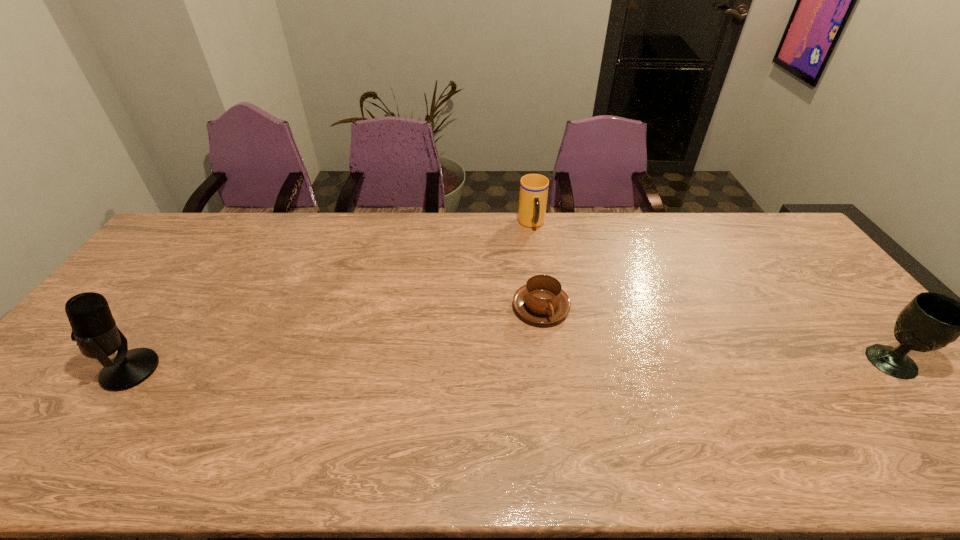
Locate an element on the screen. free space at the near edge of the desktop is located at coordinates (343, 420).

The image size is (960, 540). I want to click on vacant space at the left edge of the desktop, so click(55, 370).

Where is `vacant space at the far left corner of the desktop`? The height and width of the screenshot is (540, 960). vacant space at the far left corner of the desktop is located at coordinates (192, 234).

Locate an element on the screen. The width and height of the screenshot is (960, 540). free space at the near left corner of the desktop is located at coordinates (73, 424).

This screenshot has height=540, width=960. What are the coordinates of `blank space at the near right corner of the desktop` in the screenshot? It's located at (885, 412).

Locate an element on the screen. The image size is (960, 540). free space between the chalice and the cup is located at coordinates 711,293.

At what (x,y) coordinates should I click in order to perform the action: click on empty space that is in between the third nearest object and the cup. Please return your answer as a coordinate pair (x, y). This screenshot has width=960, height=540. Looking at the image, I should click on (537, 266).

The image size is (960, 540). In order to click on free area in between the rightmost object and the third nearest object in this screenshot , I will do `click(716, 335)`.

At what (x,y) coordinates should I click in order to perform the action: click on vacant area that lies between the microphone and the shortest object. Please return your answer as a coordinate pair (x, y). Looking at the image, I should click on (336, 339).

Locate an element on the screen. The image size is (960, 540). free space between the rightmost object and the third nearest object is located at coordinates (716, 335).